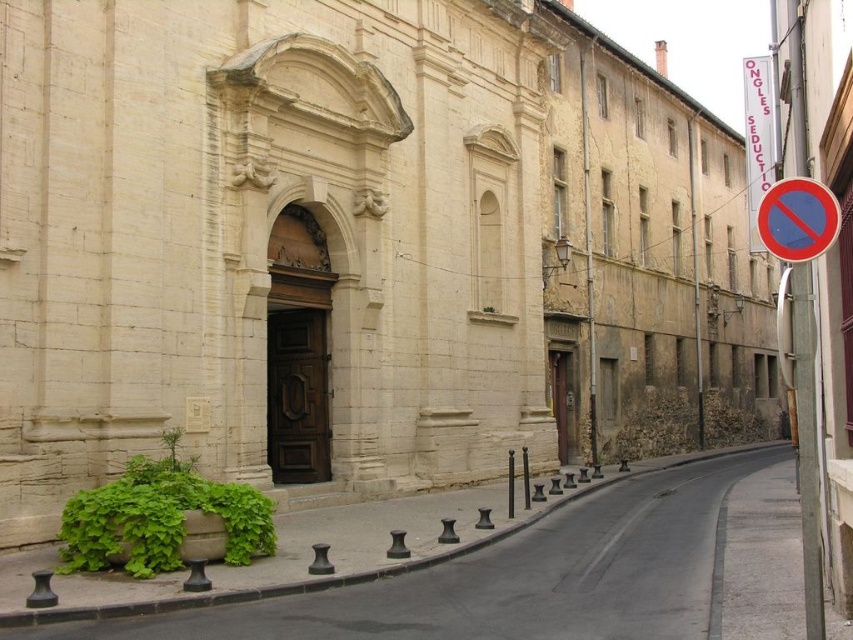
Does point (598, 580) come behind point (805, 227)?

Yes, point (598, 580) is farther from viewer.

Describe the element at coordinates (492, 580) in the screenshot. The image size is (853, 640). I see `green leafy plant at lower left` at that location.

Identify the location of green leafy plant at lower left. This screenshot has width=853, height=640. (492, 580).